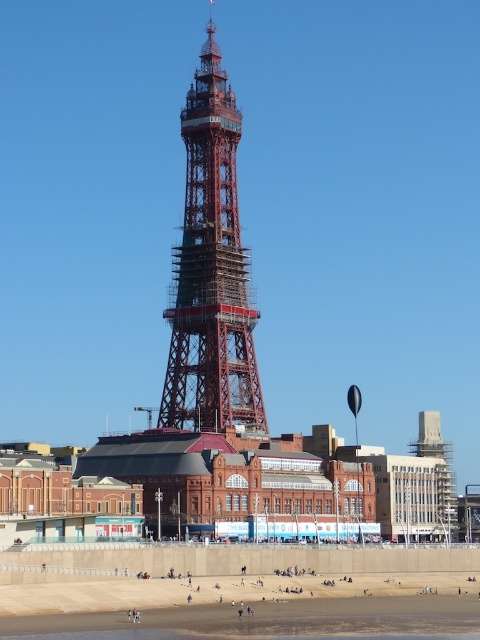
Can you confirm if red metal eiffel tower at center is positioned to the left of sandy beach at lower center?

Indeed, red metal eiffel tower at center is positioned on the left side of sandy beach at lower center.

Does red metal eiffel tower at center come in front of sandy beach at lower center?

No.

Find the location of `red metal eiffel tower at center`. red metal eiffel tower at center is located at coordinates (211, 269).